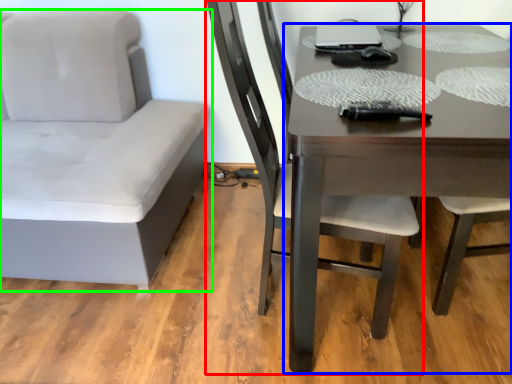
Question: Considering the real-world distances, which object is farthest from chair (highlighted by a red box)? table (highlighted by a blue box) or chair (highlighted by a green box)?

Choices:
 (A) table
 (B) chair

Answer: (B)